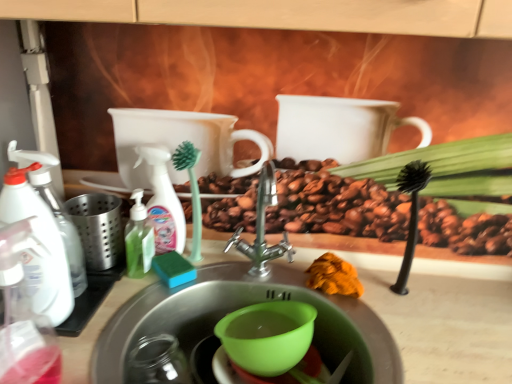
At what (x,y) coordinates should I click in order to perform the action: click on free spot in front of green translucent pump bottle at left, placed as the 2th cleaning product when sorted from right to left. Please return your answer as a coordinate pair (x, y). Looking at the image, I should click on (122, 315).